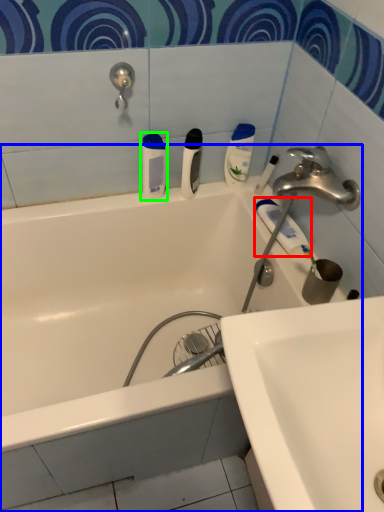
Question: Which object is the farthest from toothpaste (highlighted by a red box)? Choose among these: bathtub (highlighted by a blue box) or toiletry (highlighted by a green box).

Choices:
 (A) bathtub
 (B) toiletry

Answer: (A)